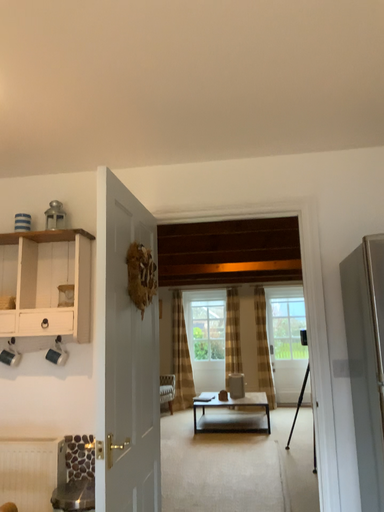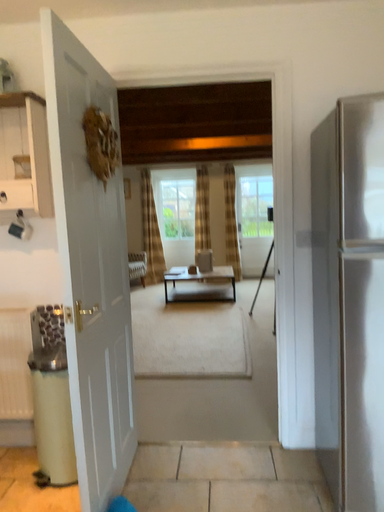
Question: How did the camera likely rotate when shooting the video?

Choices:
 (A) rotated downward
 (B) rotated upward

Answer: (A)